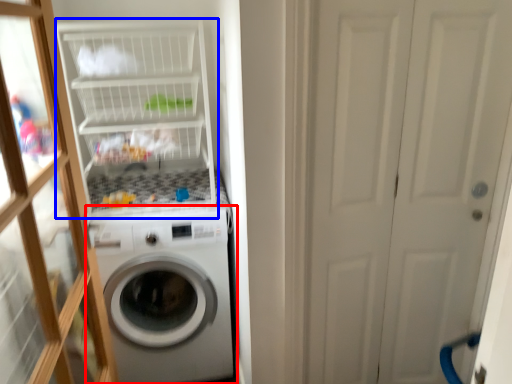
Question: Which of the following is the farthest to the observer, washing machine (highlighted by a red box) or shelf (highlighted by a blue box)?

Choices:
 (A) washing machine
 (B) shelf

Answer: (A)